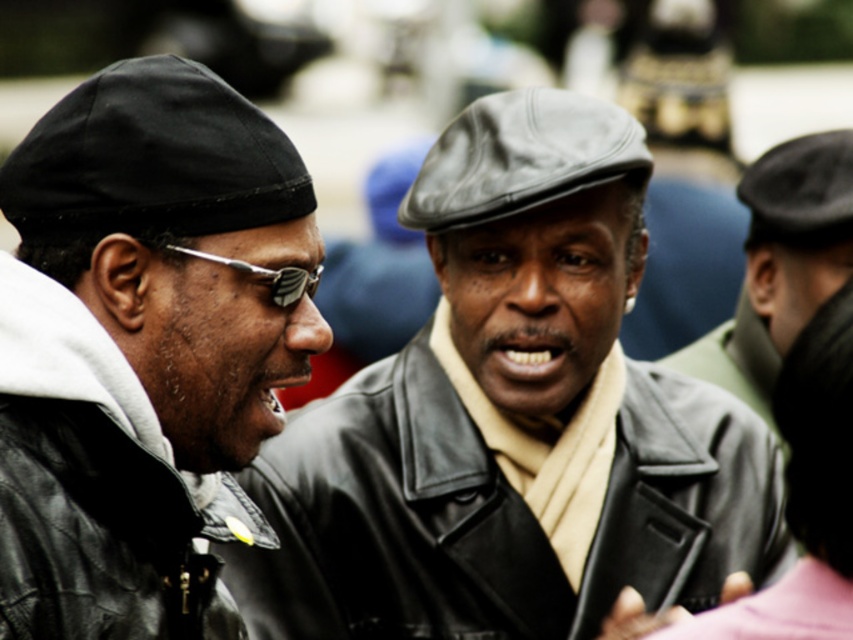
Question: Which of the following is the closest to the observer?

Choices:
 (A) (718, 372)
 (B) (109, 502)

Answer: (B)

Question: Does black leather jacket at center appear on the left side of leather cap at right?

Choices:
 (A) yes
 (B) no

Answer: (A)

Question: Observing the image, what is the correct spatial positioning of black leather jacket at left in reference to leather cap at right?

Choices:
 (A) right
 (B) left

Answer: (B)

Question: Does black leather jacket at center appear over black leather jacket at left?

Choices:
 (A) no
 (B) yes

Answer: (A)

Question: Which object appears farthest from the camera in this image?

Choices:
 (A) black leather jacket at center
 (B) black leather jacket at left
 (C) leather cap at right

Answer: (C)

Question: Which object is farther from the camera taking this photo?

Choices:
 (A) leather cap at right
 (B) black leather jacket at center
 (C) black leather jacket at left

Answer: (A)